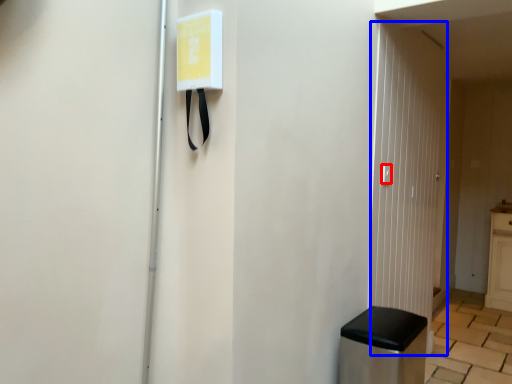
Question: Which point is closer to the camera, light switch (highlighted by a red box) or glass door (highlighted by a blue box)?

Choices:
 (A) light switch
 (B) glass door

Answer: (B)